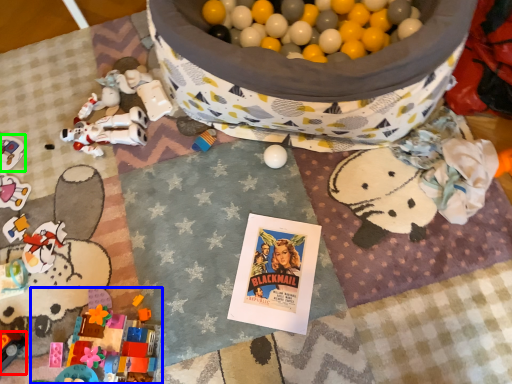
Question: Based on their relative distances, which object is nearer to toy (highlighted by a red box)? Choose from toy (highlighted by a blue box) and toy (highlighted by a green box).

Choices:
 (A) toy
 (B) toy

Answer: (A)